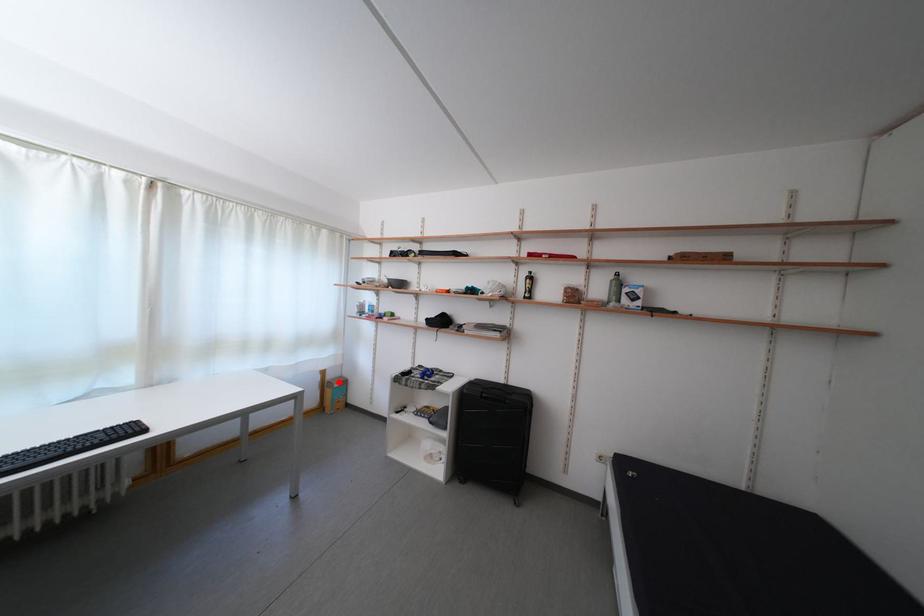
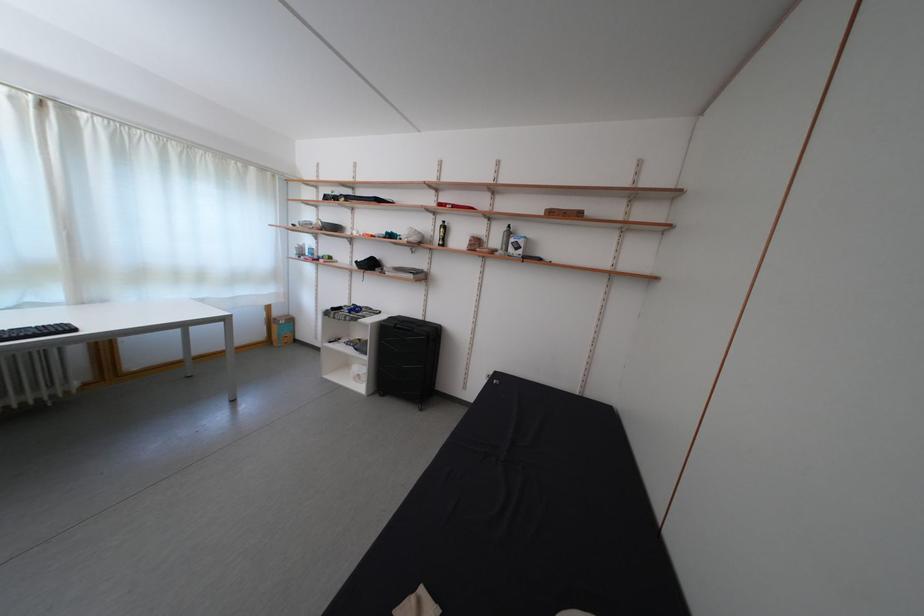
Question: I am providing you with two images of the same scene from different viewpoints. Image1 has a red point marked. In image2, the corresponding 3D location appears at what relative position? Reply with the corresponding letter.

Choices:
 (A) Closer
 (B) Farther

Answer: (A)